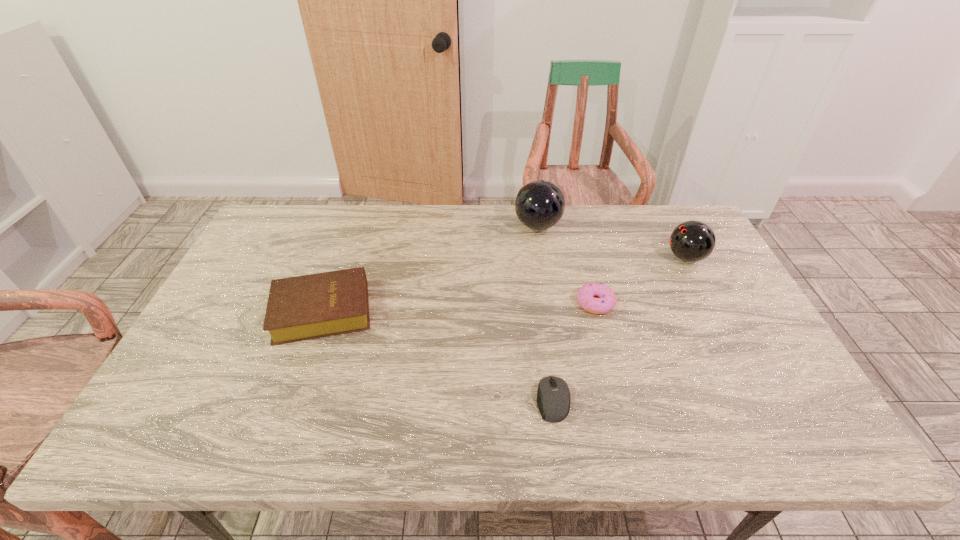
At what (x,y) coordinates should I click in order to perform the action: click on object located at the far right corner. Please return your answer as a coordinate pair (x, y). The image size is (960, 540). Looking at the image, I should click on (691, 241).

Locate an element on the screen. free point at the far edge is located at coordinates (472, 227).

You are a GUI agent. You are given a task and a screenshot of the screen. Output one action in this format:
    pyautogui.click(x=<x>, y=<y>)
    Task: Click on the blank area at the near edge
    
    Given the screenshot: What is the action you would take?
    pyautogui.click(x=574, y=431)

Image resolution: width=960 pixels, height=540 pixels. In the image, there is a desktop. Find the location of `vacant space at the left edge`. vacant space at the left edge is located at coordinates (207, 395).

Locate an element on the screen. This screenshot has width=960, height=540. vacant point at the right edge is located at coordinates (763, 353).

Locate an element on the screen. free point at the far left corner is located at coordinates (276, 212).

In the image, there is a desktop. Where is `vacant region at the near left corner`? This screenshot has width=960, height=540. vacant region at the near left corner is located at coordinates (162, 443).

At what (x,y) coordinates should I click in order to perform the action: click on vacant space at the far right corner of the desktop. Please return your answer as a coordinate pair (x, y). Looking at the image, I should click on (684, 211).

This screenshot has width=960, height=540. In order to click on free area in between the left bowling ball and the leftmost object in this screenshot , I will do (x=430, y=268).

Where is `vacant space in between the left bowling ball and the nearest object`? This screenshot has height=540, width=960. vacant space in between the left bowling ball and the nearest object is located at coordinates (545, 313).